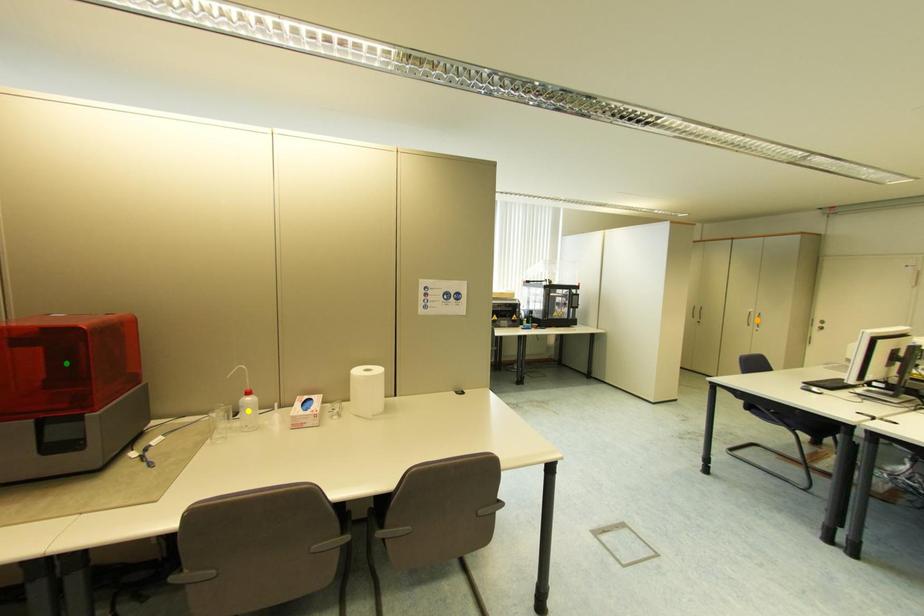
Order these from nearest to farthest:
green point
orange point
yellow point

orange point
yellow point
green point